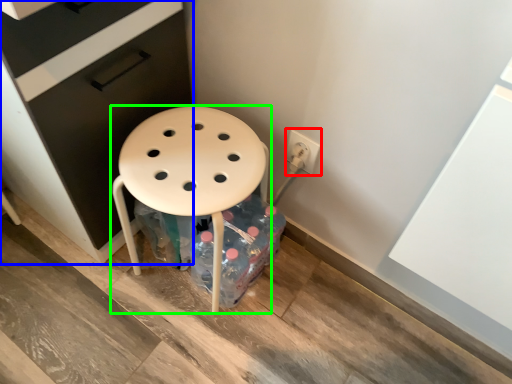
Question: Which object is the closest to the electric outlet (highlighted by a red box)? Choose among these: file cabinet (highlighted by a blue box) or stool (highlighted by a green box).

Choices:
 (A) file cabinet
 (B) stool

Answer: (B)